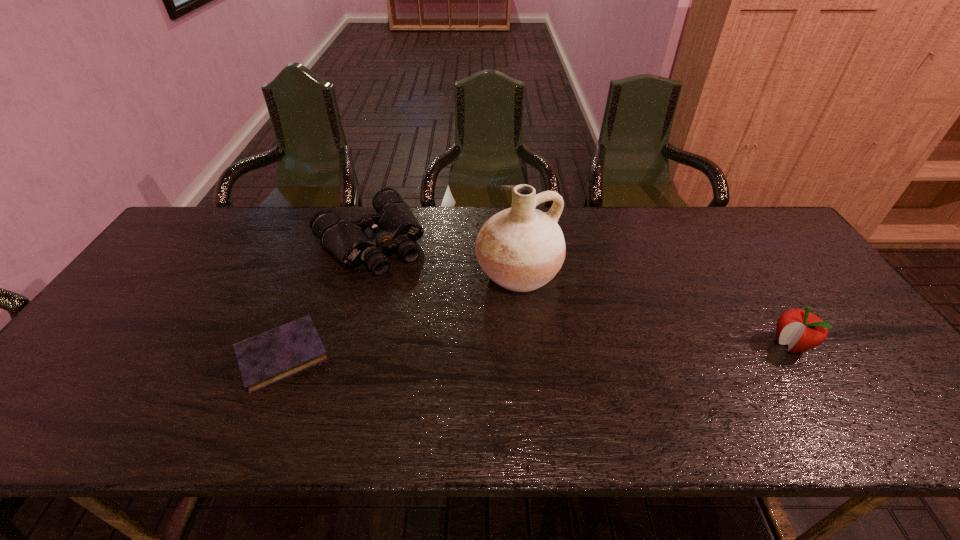
Locate an element on the screen. This screenshot has height=540, width=960. free space located through the eyepieces of the third tallest object is located at coordinates (434, 311).

Find the location of `vacant space located to pour from the handle of the pottery`. vacant space located to pour from the handle of the pottery is located at coordinates (558, 320).

You are a GUI agent. You are given a task and a screenshot of the screen. Output one action in this format:
    pyautogui.click(x=<x>, y=<y>)
    Task: Click on the free space located 0.270m to pour from the handle of the pottery
    The image size is (960, 540).
    Given the screenshot: What is the action you would take?
    pyautogui.click(x=604, y=374)

Where is `blank space located to pour from the handle of the pottery`? The height and width of the screenshot is (540, 960). blank space located to pour from the handle of the pottery is located at coordinates (571, 336).

Locate an element on the screen. The image size is (960, 540). binoculars that is at the far edge is located at coordinates coord(394,225).

The image size is (960, 540). In order to click on pottery located in the far edge section of the desktop in this screenshot , I will do `click(521, 248)`.

At what (x,y) coordinates should I click in order to perform the action: click on object that is at the near edge. Please return your answer as a coordinate pair (x, y). Looking at the image, I should click on (265, 359).

Locate an element on the screen. The width and height of the screenshot is (960, 540). object that is at the right edge is located at coordinates (802, 330).

Where is `vacant space at the far edge of the desktop`? The width and height of the screenshot is (960, 540). vacant space at the far edge of the desktop is located at coordinates (252, 247).

This screenshot has height=540, width=960. In the image, there is a desktop. What are the coordinates of `blank space at the near edge` in the screenshot? It's located at (577, 393).